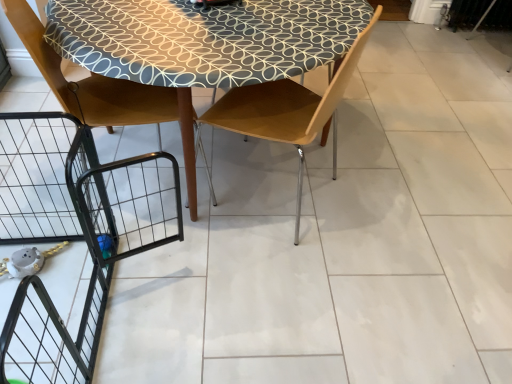
Question: From the image's perspective, is matte brown chair at left, which ranks as the first chair in left-to-right order, on top of wooden chair at center, which ranks as the 2th chair in left-to-right order?

Choices:
 (A) no
 (B) yes

Answer: (B)

Question: From the image's perspective, is matte brown chair at left, which ranks as the first chair in left-to-right order, beneath wooden chair at center, which is counted as the 1th chair, starting from the right?

Choices:
 (A) yes
 (B) no

Answer: (B)

Question: From a real-world perspective, is matte brown chair at left, the 2th chair in the right-to-left sequence, beneath wooden chair at center, which is counted as the 1th chair, starting from the right?

Choices:
 (A) no
 (B) yes

Answer: (B)

Question: Does matte brown chair at left, which ranks as the first chair in left-to-right order, touch wooden chair at center, which ranks as the 2th chair in left-to-right order?

Choices:
 (A) no
 (B) yes

Answer: (A)

Question: Can you confirm if matte brown chair at left, the 2th chair in the right-to-left sequence, is smaller than wooden chair at center, which is counted as the 1th chair, starting from the right?

Choices:
 (A) yes
 (B) no

Answer: (B)

Question: Does matte brown chair at left, the 2th chair in the right-to-left sequence, turn towards wooden chair at center, which ranks as the 2th chair in left-to-right order?

Choices:
 (A) yes
 (B) no

Answer: (A)

Question: Is wooden chair at center, which is counted as the 1th chair, starting from the right, looking in the opposite direction of matte brown chair at left, which ranks as the first chair in left-to-right order?

Choices:
 (A) no
 (B) yes

Answer: (A)

Question: Is wooden chair at center, which ranks as the 2th chair in left-to-right order, wider than matte brown chair at left, the 2th chair in the right-to-left sequence?

Choices:
 (A) yes
 (B) no

Answer: (B)

Question: Is wooden chair at center, which is counted as the 1th chair, starting from the right, located outside matte brown chair at left, which ranks as the first chair in left-to-right order?

Choices:
 (A) yes
 (B) no

Answer: (A)

Question: From a real-world perspective, is wooden chair at center, which is counted as the 1th chair, starting from the right, on top of matte brown chair at left, the 2th chair in the right-to-left sequence?

Choices:
 (A) yes
 (B) no

Answer: (A)

Question: Does wooden chair at center, which ranks as the 2th chair in left-to-right order, come in front of matte brown chair at left, the 2th chair in the right-to-left sequence?

Choices:
 (A) no
 (B) yes

Answer: (B)

Question: Can you see wooden chair at center, which is counted as the 1th chair, starting from the right, touching matte brown chair at left, which ranks as the first chair in left-to-right order?

Choices:
 (A) no
 (B) yes

Answer: (A)

Question: In terms of width, does matte brown chair at left, the 2th chair in the right-to-left sequence, look wider or thinner when compared to wooden chair at center, which is counted as the 1th chair, starting from the right?

Choices:
 (A) wide
 (B) thin

Answer: (A)